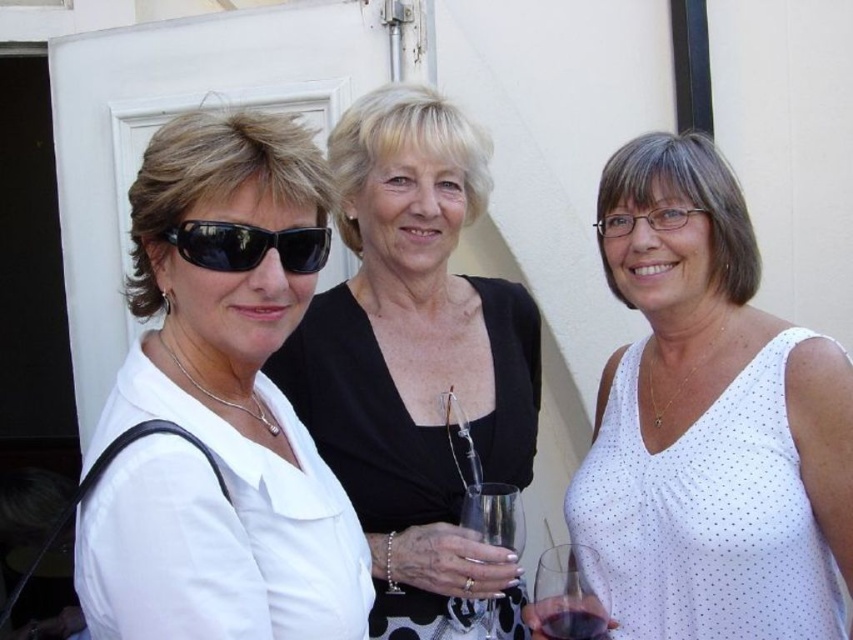
You are organizing a photoshoot and need to ensure that the white matte shirt at left and the black matte dress at center are framed properly. Based on their sizes, which one should you focus on to avoid cropping the edges?

The black matte dress at center occupies more space than the white matte shirt at left, so you should focus on framing the black matte dress at center to avoid cropping its edges.

You are organizing a clothing store and need to arrange the white matte shirt at left and the white dotted tank top at center on a rack. Since the rack has limited space, which item should you place first to ensure both fit properly?

The white matte shirt at left should be placed first because it occupies less space than the white dotted tank top at center, allowing both items to fit on the rack.